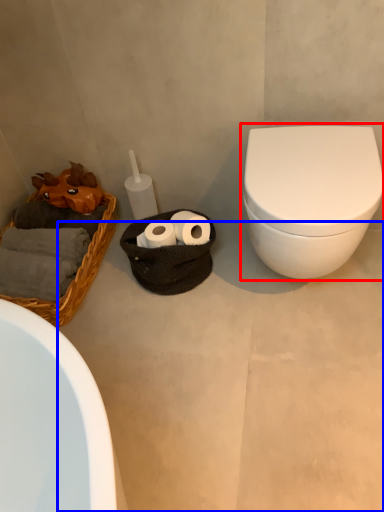
Question: Which object is further to the camera taking this photo, toilet (highlighted by a red box) or concrete (highlighted by a blue box)?

Choices:
 (A) toilet
 (B) concrete

Answer: (A)